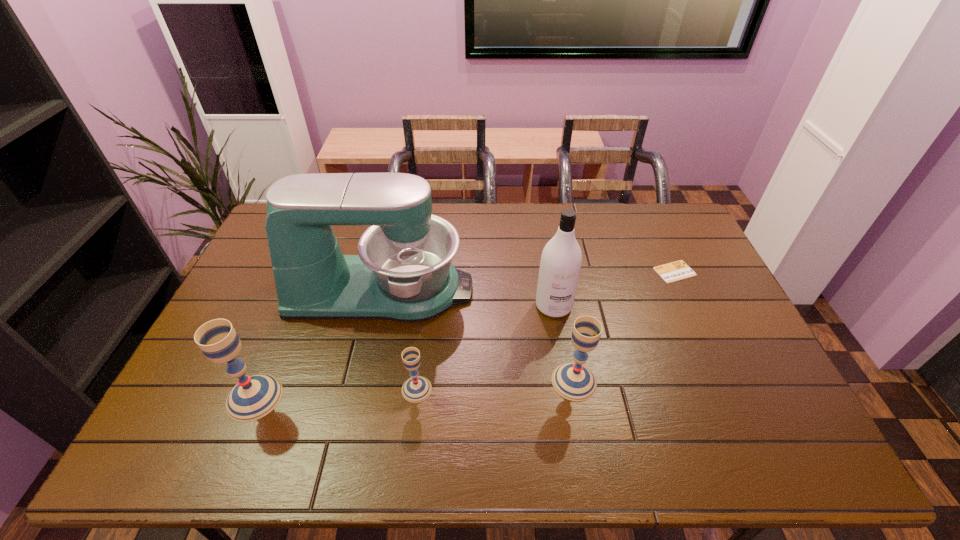
Locate an element on the screen. This screenshot has height=540, width=960. object that can be found as the closest to the second shortest object is located at coordinates (403, 272).

The width and height of the screenshot is (960, 540). What are the coordinates of `chalice that can be found as the second closest to the second shortest chalice` in the screenshot? It's located at (255, 396).

Choose which chalice is the second nearest neighbor to the shortest object. Please provide its 2D coordinates. Your answer should be formatted as a tuple, i.e. [(x, y)], where the tuple contains the x and y coordinates of a point satisfying the conditions above.

[(416, 389)]

I want to click on vacant area in the image that satisfies the following two spatial constraints: 1. on the front-facing side of the mixer; 2. on the right side of the rightmost chalice, so click(361, 381).

Image resolution: width=960 pixels, height=540 pixels. I want to click on free space that satisfies the following two spatial constraints: 1. on the front-facing side of the rightmost chalice; 2. on the left side of the shampoo, so click(566, 381).

This screenshot has height=540, width=960. I want to click on free space that satisfies the following two spatial constraints: 1. on the back side of the second chalice from right to left; 2. on the front-facing side of the mixer, so click(x=428, y=290).

Where is `free spot that satisfies the following two spatial constraints: 1. on the front-facing side of the shampoo; 2. on the left side of the fourth tallest object`? The width and height of the screenshot is (960, 540). free spot that satisfies the following two spatial constraints: 1. on the front-facing side of the shampoo; 2. on the left side of the fourth tallest object is located at coordinates (566, 381).